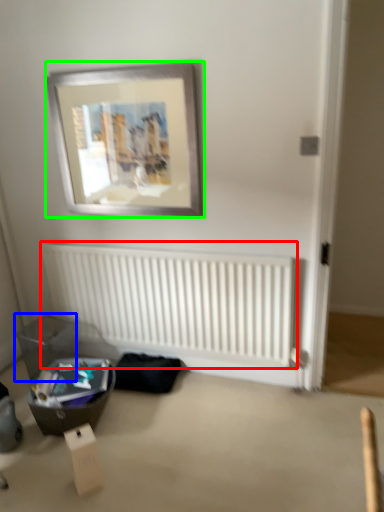
Question: Which is farther away from radiator (highlighted by a red box)? storage box (highlighted by a blue box) or picture frame (highlighted by a green box)?

Choices:
 (A) storage box
 (B) picture frame

Answer: (B)